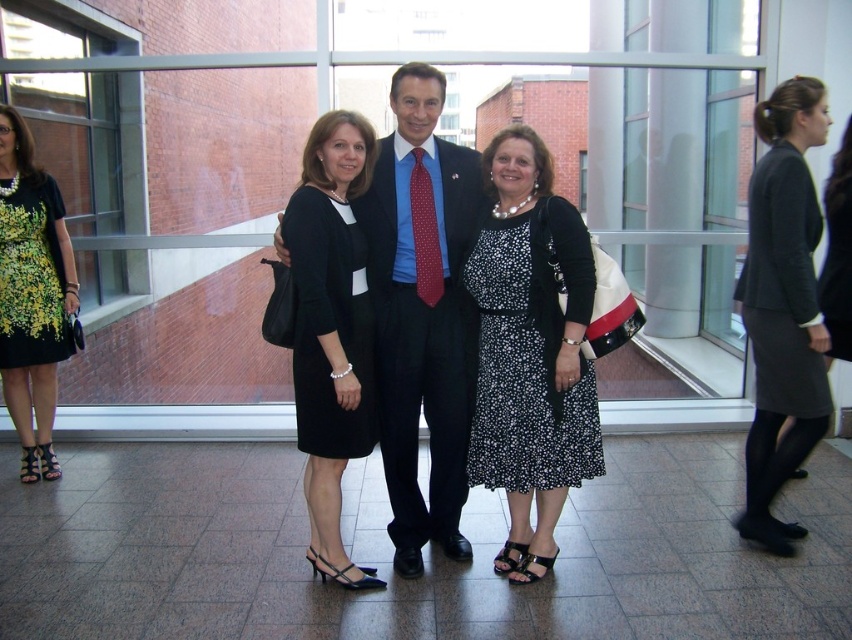
You are a photographer at the event and want to adjust the lighting so that the dark gray wool skirt at right and the printed fabric dress at left are both well lit. Since the skirt is below the dress, where should you position the light source to ensure both are illuminated evenly?

The dark gray wool skirt at right is below the printed fabric dress at left. To ensure both are evenly lit, position the light source above the printed fabric dress at left so that it illuminates downward, covering both the dress and the skirt below.

You are a photographer adjusting the camera settings to focus on the dark gray wool skirt at right. Given that the camera focuses best at point 0.5 on the horizontal axis, is the skirt positioned to the left or right of the optimal focus point?

The dark gray wool skirt at right is located at point 0.478 on the horizontal axis, which is slightly to the left of the optimal focus point at 0.5. Therefore, the skirt is positioned to the left of the optimal focus point.

You are a photographer at the event and need to arrange the two women wearing the black dotted dress at center and the black matte dress at center so that they can both fit comfortably in the frame. Given their dress widths, which woman should stand closer to the edge of the frame?

The woman wearing the black dotted dress at center has a wider dress, so she should stand closer to the edge of the frame to accommodate her dress width and ensure both women fit comfortably.